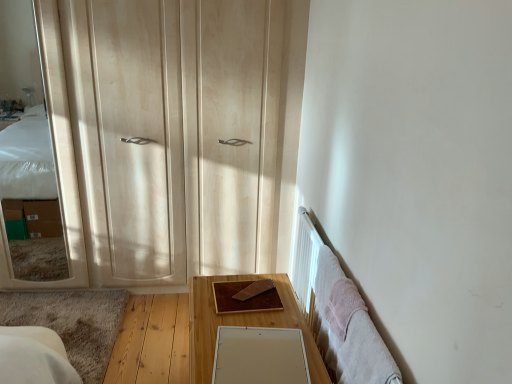
Locate an element on the screen. free space above white matte mirror at lower center, which appears as the 2th mirror when viewed from the back (from a real-world perspective) is located at coordinates pos(256,366).